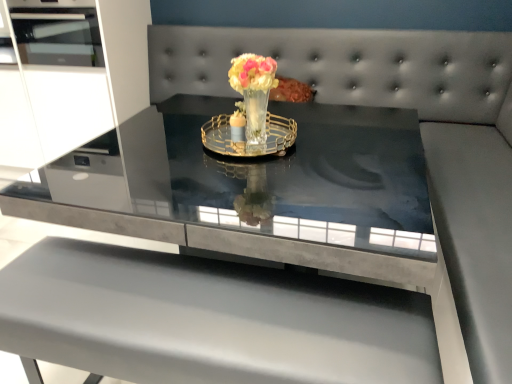
Question: Looking at their shapes, would you say gold metallic tray at center is wider or thinner than smooth gray couch at center?

Choices:
 (A) wide
 (B) thin

Answer: (B)

Question: Based on their positions, is gold metallic tray at center located to the left or right of smooth gray couch at center?

Choices:
 (A) left
 (B) right

Answer: (A)

Question: Considering the real-world distances, which object is closest to the matte gray table at center?

Choices:
 (A) gold metallic tray at center
 (B) smooth gray couch at center
 (C) translucent glass vase at center

Answer: (A)

Question: Which object is positioned farthest from the smooth gray couch at center?

Choices:
 (A) translucent glass vase at center
 (B) matte gray table at center
 (C) gold metallic tray at center

Answer: (B)